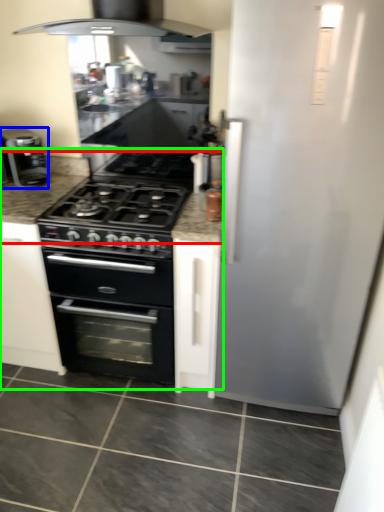
Question: Which is nearer to the countertop (highlighted by a red box)? kitchen appliance (highlighted by a blue box) or counter (highlighted by a green box).

Choices:
 (A) kitchen appliance
 (B) counter

Answer: (A)